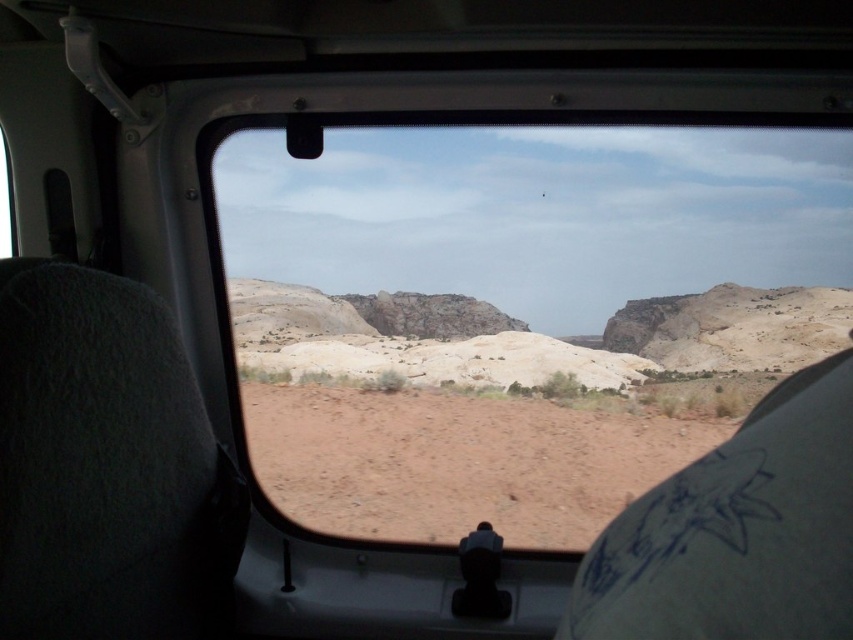
You are a passenger in the vehicle and want to see the brown sandy dirt at center outside. Can you look through the transparent glass window at center to see it?

Yes, because the transparent glass window at center is located above the brown sandy dirt at center, allowing you to look downward through it to view the dirt.

You are a passenger in the vehicle and want to see the brown sandy dirt at center outside. Can you see it through the transparent glass window at center?

Yes, because the transparent glass window at center is in front of the brown sandy dirt at center, allowing you to see it through the window.